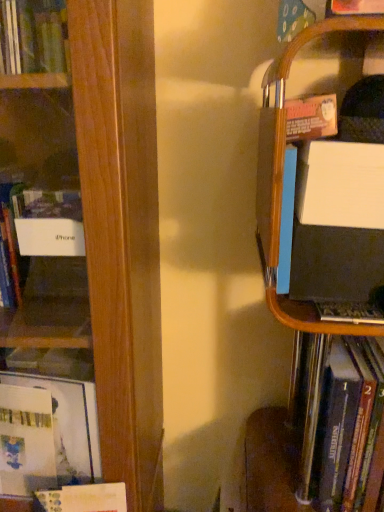
Question: Does wooden bookshelf at left, which ranks as the 3th book in right-to-left order, have a greater width compared to white paper at lower left, the second book viewed from the left?

Choices:
 (A) yes
 (B) no

Answer: (A)

Question: Is wooden bookshelf at left, which ranks as the 3th book in right-to-left order, facing towards white paper at lower left, the second book viewed from the left?

Choices:
 (A) no
 (B) yes

Answer: (B)

Question: Is white paper at lower left, the second book viewed from the left, at the back of wooden bookshelf at left, which ranks as the first book in left-to-right order?

Choices:
 (A) no
 (B) yes

Answer: (B)

Question: From the image's perspective, does wooden bookshelf at left, which ranks as the first book in left-to-right order, appear lower than white paper at lower left, the second book viewed from the left?

Choices:
 (A) yes
 (B) no

Answer: (B)

Question: Is wooden bookshelf at left, which ranks as the 3th book in right-to-left order, at the left side of white paper at lower left, the second book viewed from the left?

Choices:
 (A) no
 (B) yes

Answer: (B)

Question: Can you confirm if wooden bookshelf at left, which ranks as the first book in left-to-right order, is shorter than white paper at lower left, the second book viewed from the right?

Choices:
 (A) yes
 (B) no

Answer: (B)

Question: From a real-world perspective, is white paper at lower left, the second book viewed from the left, beneath black matte laptop at right, which is counted as the first book, starting from the right?

Choices:
 (A) no
 (B) yes

Answer: (B)

Question: Considering the relative positions of white paper at lower left, the second book viewed from the left, and black matte laptop at right, which is counted as the first book, starting from the right, in the image provided, is white paper at lower left, the second book viewed from the left, to the left of black matte laptop at right, which is counted as the first book, starting from the right, from the viewer's perspective?

Choices:
 (A) yes
 (B) no

Answer: (A)

Question: Is white paper at lower left, the second book viewed from the right, smaller than black matte laptop at right, acting as the 3th book starting from the left?

Choices:
 (A) yes
 (B) no

Answer: (A)

Question: Does white paper at lower left, the second book viewed from the right, have a larger size compared to black matte laptop at right, which is counted as the first book, starting from the right?

Choices:
 (A) yes
 (B) no

Answer: (B)

Question: Does white paper at lower left, the second book viewed from the right, have a lesser width compared to black matte laptop at right, which is counted as the first book, starting from the right?

Choices:
 (A) yes
 (B) no

Answer: (A)

Question: Is white paper at lower left, the second book viewed from the left, surrounding black matte laptop at right, which is counted as the first book, starting from the right?

Choices:
 (A) yes
 (B) no

Answer: (B)

Question: Does matte black laptop at right lie behind wooden bookshelf at left, which ranks as the first book in left-to-right order?

Choices:
 (A) yes
 (B) no

Answer: (A)